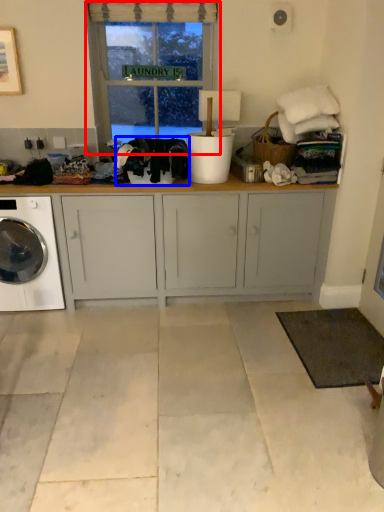
Question: Which point is closer to the camera, window (highlighted by a red box) or clothing (highlighted by a blue box)?

Choices:
 (A) window
 (B) clothing

Answer: (B)